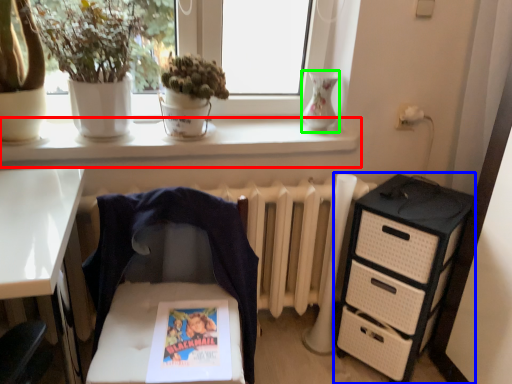
Question: Which object is the closest to the window sill (highlighted by a red box)? Choose among these: chest of drawers (highlighted by a blue box) or vase (highlighted by a green box).

Choices:
 (A) chest of drawers
 (B) vase

Answer: (B)